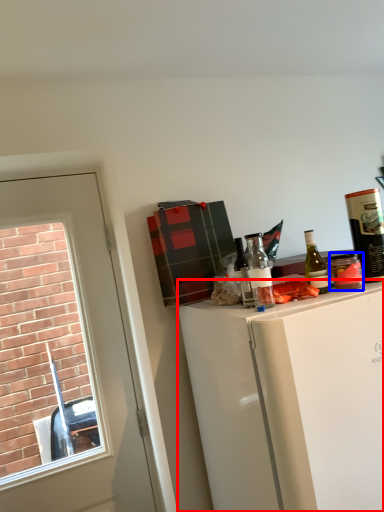
Question: Which point is closer to the camera, cabinetry (highlighted by a red box) or beverage (highlighted by a blue box)?

Choices:
 (A) cabinetry
 (B) beverage

Answer: (A)